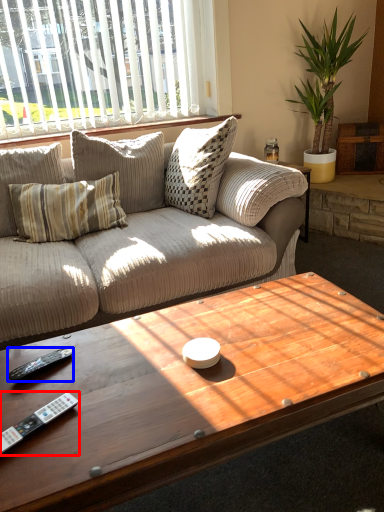
Question: Which object is further to the camera taking this photo, control (highlighted by a red box) or remote (highlighted by a blue box)?

Choices:
 (A) control
 (B) remote

Answer: (B)